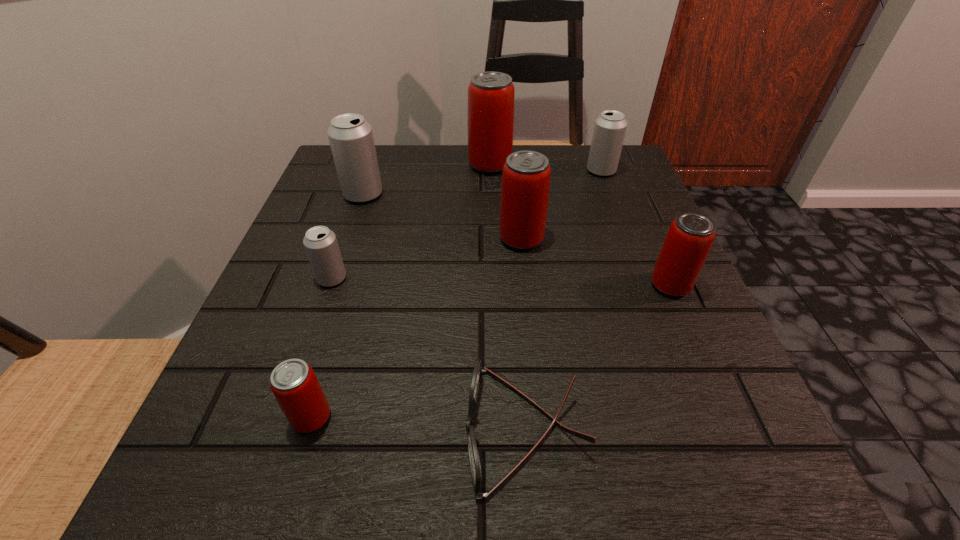
I want to click on blank area in the image that satisfies the following two spatial constraints: 1. on the back side of the fifth nearest beer can; 2. on the right side of the biggest pink beer can, so click(372, 165).

I want to click on vacant area that satisfies the following two spatial constraints: 1. on the front side of the third farthest pink beer can; 2. on the left side of the rightmost white beer can, so click(645, 286).

At what (x,y) coordinates should I click in order to perform the action: click on free location that satisfies the following two spatial constraints: 1. on the front side of the second smallest pink beer can; 2. on the left side of the third nearest pink beer can. Please return your answer as a coordinate pair (x, y). The height and width of the screenshot is (540, 960). Looking at the image, I should click on (526, 286).